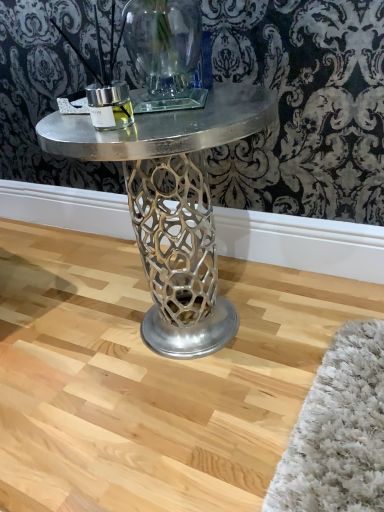
Question: Should I look upward or downward to see white fluffy rug at lower right?

Choices:
 (A) down
 (B) up

Answer: (A)